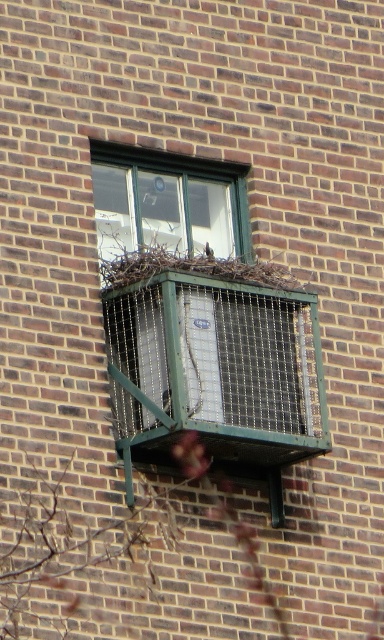
You are a delivery person trying to install a new air conditioner. The current air conditioner is in the green mesh bird cage at center. You need to place the new unit next to the green glass window at upper center. Can the new unit fit next to the window if the space available is the same size as the current cage?

The green mesh bird cage at center is larger in size than the green glass window at upper center. Since the new unit needs to be placed next to the window and the available space matches the cage size, the space should be sufficient as the cage is larger than the window.

You are standing in front of a brick wall and see the green mesh air conditioner at center and the brown textured twig at lower left. Which object is positioned higher on the wall?

The green mesh air conditioner at center is positioned higher on the wall than the brown textured twig at lower left.